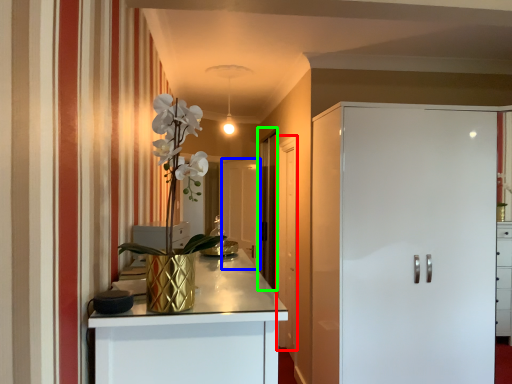
Question: Which object is the farthest from door (highlighted by a red box)? Choose among these: glass door (highlighted by a blue box) or glass door (highlighted by a green box).

Choices:
 (A) glass door
 (B) glass door

Answer: (A)